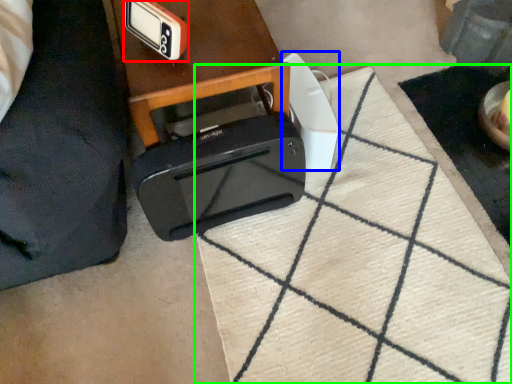
Question: Based on their relative distances, which object is farther from gadget (highlighted by a red box)? Choose from appliance (highlighted by a blue box) and doormat (highlighted by a green box).

Choices:
 (A) appliance
 (B) doormat

Answer: (B)